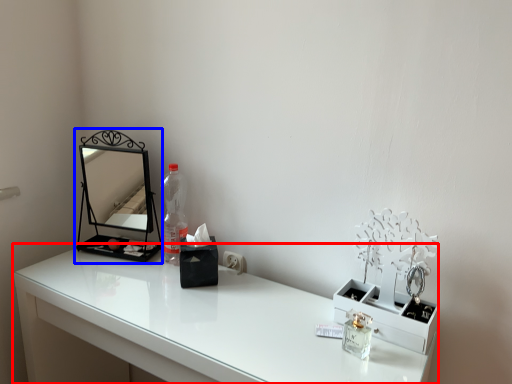
Question: Which of the following is the closest to the observer, table (highlighted by a red box) or medicine cabinet (highlighted by a blue box)?

Choices:
 (A) table
 (B) medicine cabinet

Answer: (A)